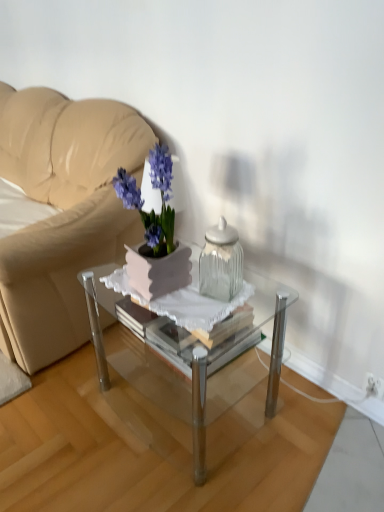
Question: From a real-world perspective, is matte purple flower pot at center on top of clear glass jar at center?

Choices:
 (A) no
 (B) yes

Answer: (B)

Question: Is matte purple flower pot at center surrounding clear glass jar at center?

Choices:
 (A) no
 (B) yes

Answer: (A)

Question: From a real-world perspective, is matte purple flower pot at center physically below clear glass jar at center?

Choices:
 (A) no
 (B) yes

Answer: (A)

Question: Are matte purple flower pot at center and clear glass jar at center far apart?

Choices:
 (A) yes
 (B) no

Answer: (B)

Question: Is matte purple flower pot at center facing towards clear glass jar at center?

Choices:
 (A) no
 (B) yes

Answer: (A)

Question: In the image, is white plastic electric outlet at lower right positioned in front of or behind clear glass jar at center?

Choices:
 (A) front
 (B) behind

Answer: (B)

Question: From the image's perspective, is white plastic electric outlet at lower right positioned above or below clear glass jar at center?

Choices:
 (A) below
 (B) above

Answer: (A)

Question: Looking at the image, does white plastic electric outlet at lower right seem bigger or smaller compared to clear glass jar at center?

Choices:
 (A) big
 (B) small

Answer: (B)

Question: Is white plastic electric outlet at lower right spatially inside clear glass jar at center, or outside of it?

Choices:
 (A) inside
 (B) outside

Answer: (B)

Question: From the image's perspective, is beige leather couch at upper left positioned above or below white plastic electric outlet at lower right?

Choices:
 (A) above
 (B) below

Answer: (A)

Question: Is beige leather couch at upper left wider or thinner than white plastic electric outlet at lower right?

Choices:
 (A) wide
 (B) thin

Answer: (A)

Question: From a real-world perspective, is beige leather couch at upper left above or below white plastic electric outlet at lower right?

Choices:
 (A) above
 (B) below

Answer: (A)

Question: Is beige leather couch at upper left spatially inside white plastic electric outlet at lower right, or outside of it?

Choices:
 (A) inside
 (B) outside

Answer: (B)

Question: Is clear glass coffee table at center inside the boundaries of white plastic electric outlet at lower right, or outside?

Choices:
 (A) outside
 (B) inside

Answer: (A)

Question: Is point 195,377 closer or farther from the camera than point 370,373?

Choices:
 (A) farther
 (B) closer

Answer: (B)